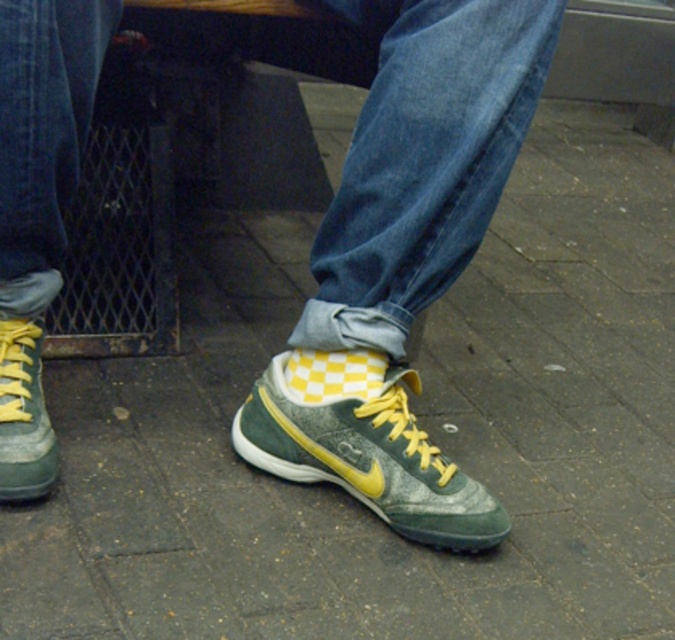
You are a photographer trying to capture the green textured sneakers at center and the green suede sneaker at center in a single shot. Which one will appear larger in the photo?

The green textured sneakers at center will appear larger in the photo because it is closer to the viewer than the green suede sneaker at center.

You are standing in front of the person shown in the image. Which of the two points, point (0, 96) or point (30, 372), is closer to you?

Point (0, 96) is closer to you because it is in front of point (30, 372).

You are standing in front of a person wearing blue jeans and checkered socks. You notice a green suede sneaker at center. Based on the coordinates provided in the description, can you determine if the sneaker is positioned closer to the top or bottom of the image?

The green suede sneaker at center is located at point coordinates with a y value of 0.545. Since the coordinate system typically places 0 at the bottom and 1 at the top, a y value of 0.545 means it is closer to the bottom of the image.